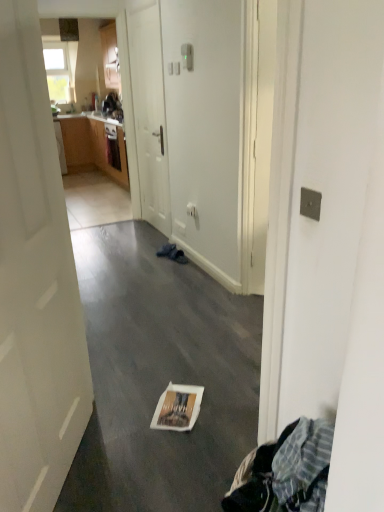
I want to click on free space in front of white glossy magazine at center, so click(x=169, y=444).